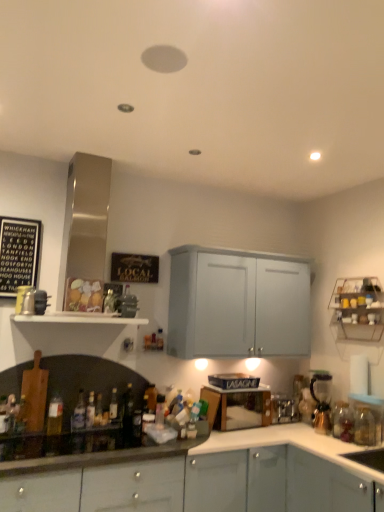
I want to click on vacant area that is in front of translucent glass bottle at lower left, the fourth bottle viewed from the right, so click(104, 432).